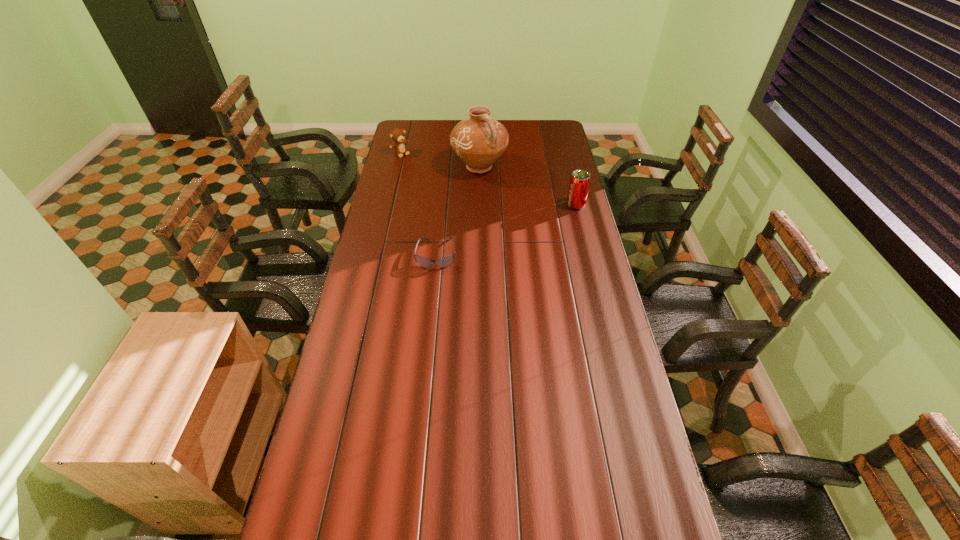
Locate an element on the screen. Image resolution: width=960 pixels, height=540 pixels. vacant spot on the desktop that is between the nearest object and the soda can and is positioned on the face of the leftmost object is located at coordinates (491, 234).

Where is `free space on the desktop that is between the shortest object and the third shortest object and is positioned on the side of the pottery with the handle`? Image resolution: width=960 pixels, height=540 pixels. free space on the desktop that is between the shortest object and the third shortest object and is positioned on the side of the pottery with the handle is located at coordinates (x=526, y=222).